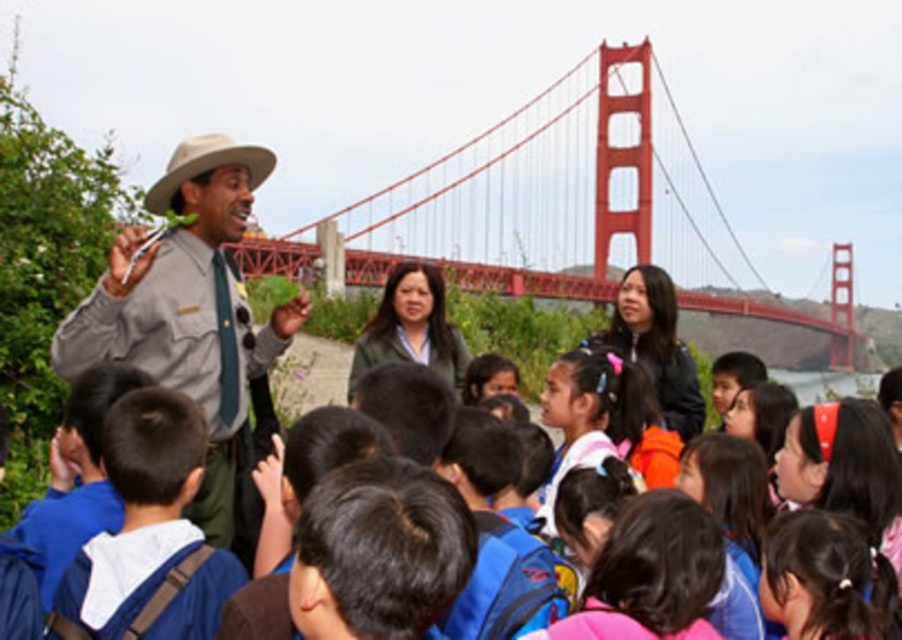
In the scene shown: You are a photographer standing at the base of the red suspension bridge and want to take a photo of the gray uniform at center and the blue fabric backpack at center. Which object should you focus on first to ensure both are in sharp focus?

The gray uniform at center is further to the viewer than the blue fabric backpack at center, so you should focus on the gray uniform at center first to ensure both are in sharp focus.

You are standing at the base of the red painted steel suspension bridge at upper center and want to reach the other side. The bridge is 544.07 feet away from you. If you walk at a speed of 3 feet per second, how many seconds will it take you to cross the bridge?

The red painted steel suspension bridge at upper center is 544.07 feet away from the viewer. To cross the bridge at a speed of 3 feet per second, it would take approximately 544.07 divided by 3, which equals about 181.36 seconds. Since you can round to the nearest whole number, it would take roughly 181 seconds to cross the bridge.

You are standing at the point with coordinates point (x=121, y=476) and want to walk to the point with coordinates point (x=255, y=337). Is the destination point in front of or behind you?

The destination point (x=255, y=337) is behind point (x=121, y=476), so it is behind you.